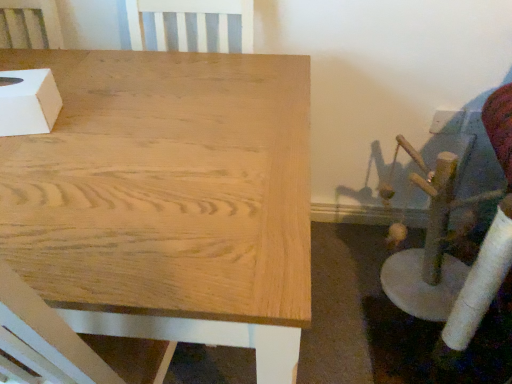
At what (x,y) coordinates should I click in order to perform the action: click on vacant space in front of white matte tissue box at upper left. Please return your answer as a coordinate pair (x, y). The height and width of the screenshot is (384, 512). Looking at the image, I should click on (22, 162).